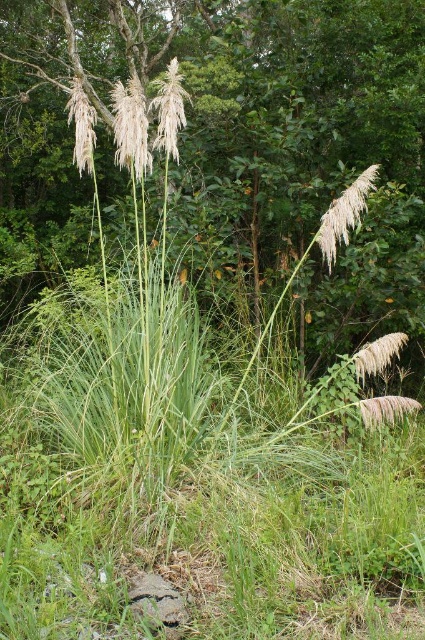
Question: Which point is closer to the camera?

Choices:
 (A) (119, 124)
 (B) (178, 113)
 (C) (322, 296)
 (D) (368, 173)

Answer: (A)

Question: Which of the following is the closest to the observer?

Choices:
 (A) (405, 10)
 (B) (118, 92)
 (C) (164, 140)

Answer: (C)

Question: Is white fluffy grass at upper right thinner than silvery-green grass at upper left?

Choices:
 (A) no
 (B) yes

Answer: (A)

Question: Does green grass-like plant at center appear on the right side of silvery-green grass at upper left?

Choices:
 (A) yes
 (B) no

Answer: (A)

Question: Is white fluffy grass at upper right positioned behind green grass-like plant at center?

Choices:
 (A) no
 (B) yes

Answer: (A)

Question: Which point appears closest to the camera in this image?

Choices:
 (A) (172, 144)
 (B) (300, 156)
 (C) (87, 138)
 (D) (136, 93)

Answer: (C)